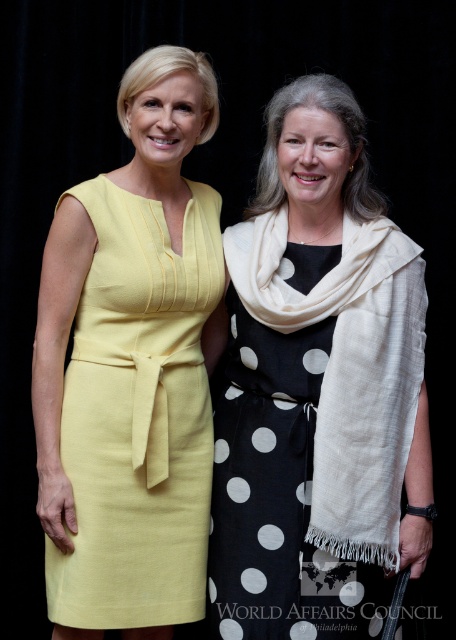
You are a photographer at a formal event and need to adjust the lighting so that both the matte yellow dress at left and the black dotted dress at center are well illuminated. However, the current lighting setup only allows you to focus on one dress at a time. Based on their positions, which dress should you prioritize to ensure the other is still partially lit?

The matte yellow dress at left is positioned over the black dotted dress at center. Therefore, prioritizing the matte yellow dress at left in the lighting will ensure the black dotted dress at center receives some indirect light from above.

You are a photographer at a formal event. You need to place a small decorative flower at point (139,417). Which object from the scene will this flower be placed on?

The small decorative flower will be placed on the matte yellow dress at left located at point (139,417).